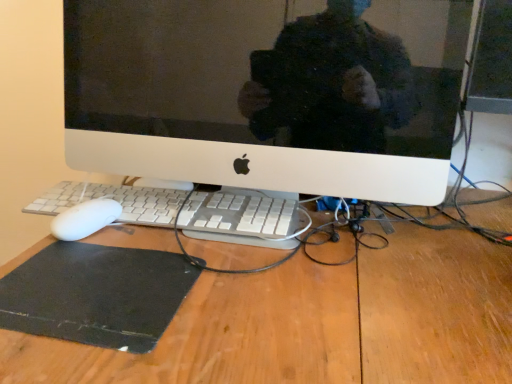
Question: Is wooden desk at center inside white plastic keyboard at center?

Choices:
 (A) yes
 (B) no

Answer: (B)

Question: From the image's perspective, would you say white plastic keyboard at center is shown under wooden desk at center?

Choices:
 (A) yes
 (B) no

Answer: (B)

Question: Can you confirm if white plastic keyboard at center is wider than wooden desk at center?

Choices:
 (A) no
 (B) yes

Answer: (A)

Question: Is white plastic keyboard at center outside wooden desk at center?

Choices:
 (A) no
 (B) yes

Answer: (B)

Question: Is white plastic keyboard at center oriented towards wooden desk at center?

Choices:
 (A) yes
 (B) no

Answer: (B)

Question: Are white plastic keyboard at center and wooden desk at center beside each other?

Choices:
 (A) yes
 (B) no

Answer: (B)

Question: Is wooden desk at center not near white plastic computer monitor at center?

Choices:
 (A) yes
 (B) no

Answer: (B)

Question: Does wooden desk at center have a smaller size compared to white plastic computer monitor at center?

Choices:
 (A) yes
 (B) no

Answer: (B)

Question: From the image's perspective, is wooden desk at center above white plastic computer monitor at center?

Choices:
 (A) yes
 (B) no

Answer: (B)

Question: From a real-world perspective, does wooden desk at center stand above white plastic computer monitor at center?

Choices:
 (A) yes
 (B) no

Answer: (B)

Question: Is wooden desk at center completely or partially outside of white plastic computer monitor at center?

Choices:
 (A) no
 (B) yes

Answer: (B)

Question: Is wooden desk at center to the left of white plastic computer monitor at center from the viewer's perspective?

Choices:
 (A) yes
 (B) no

Answer: (B)

Question: Considering the relative sizes of black rubber mousepad at lower left and white plastic keyboard at center in the image provided, is black rubber mousepad at lower left taller than white plastic keyboard at center?

Choices:
 (A) yes
 (B) no

Answer: (B)